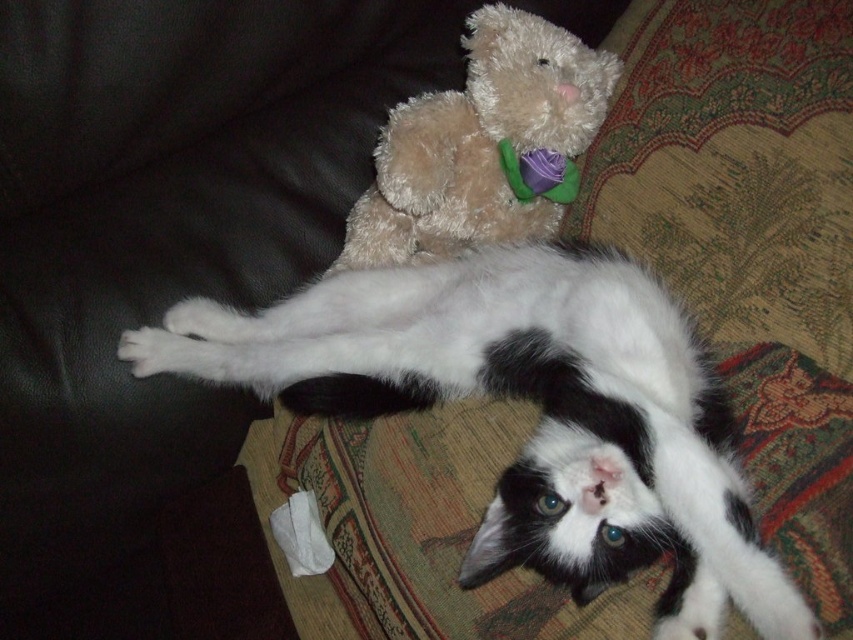
You are a photographer trying to capture a closeup shot of the black and white cat lying on the couch. You notice two specific points in the scene marked as point 1 at coordinates (735,547) and point 2 at coordinates (421,104). Which point should you focus on to ensure the cat is in sharp focus?

You should focus on point 1 at coordinates (735,547) because it is closer to the viewer than point 2 at coordinates (421,104), ensuring the cat is in sharp focus.

In the scene shown: You are a toy maker who needs to place a new toy between the white soft fur cat at center and the fuzzy brown teddy bear at upper center. The toy requires 10 inches of space to fit. Can you fit the toy between them?

The distance between the white soft fur cat at center and the fuzzy brown teddy bear at upper center is 7.52 inches, which is less than the required 10 inches. Therefore, the toy cannot be placed between them.

You are a photographer trying to capture a closeup of the white soft fur cat at center. However, you notice the fuzzy brown teddy bear at upper center might be blocking your shot. Based on their positions, can you determine if the teddy bear is in front of or behind the cat?

The white soft fur cat at center is located below the fuzzy brown teddy bear at upper center, so the teddy bear is in front of the cat. This means the teddy bear is blocking the shot.